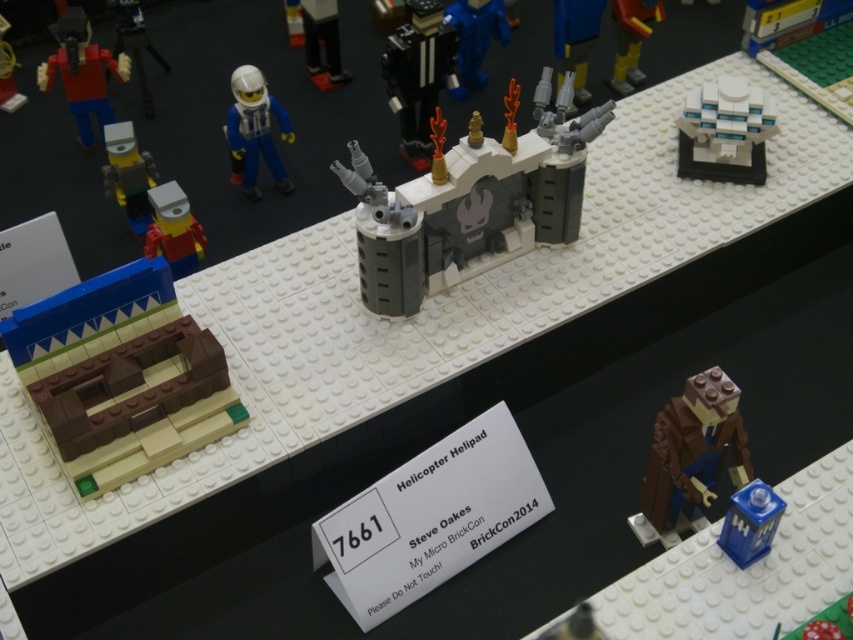
You are standing at the point marked as point (466, 166) in the LEGO display at BrickCon. You want to take a photo of the central helipad model. Will you be able to capture the entire helipad in your shot without moving from your current position?

The point (466, 166) is 4.06 feet away from the viewer. Since the helipad is the central piece and the distance is sufficient, you should be able to capture the entire helipad in your shot without moving.

You are at the BrickCon event and see two astronauts in the LEGO display. Which astronaut, the matte white plastic astronaut at upper center or the matte white astronaut at upper left, is taller?

The matte white astronaut at upper left is taller than the matte white plastic astronaut at upper center.